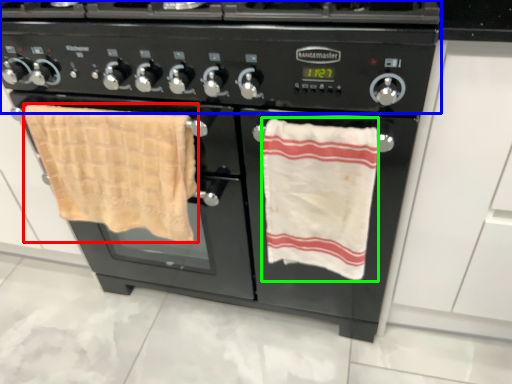
Question: Considering the real-world distances, which object is farthest from beach towel (highlighted by a red box)? gas stove (highlighted by a blue box) or beach towel (highlighted by a green box)?

Choices:
 (A) gas stove
 (B) beach towel

Answer: (B)